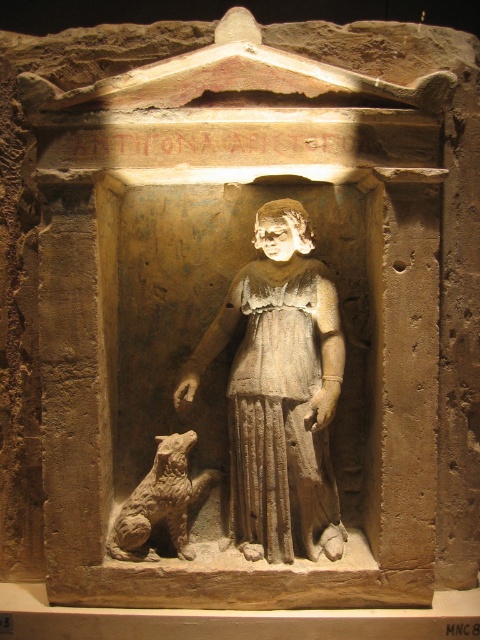
Question: Is gray stone statue at center positioned behind brown textured dog at lower left?

Choices:
 (A) no
 (B) yes

Answer: (A)

Question: Can you confirm if gray stone statue at center is positioned above brown textured dog at lower left?

Choices:
 (A) no
 (B) yes

Answer: (B)

Question: Which point is closer to the camera?

Choices:
 (A) (180, 544)
 (B) (297, 492)

Answer: (B)

Question: Can you confirm if gray stone statue at center is positioned to the right of brown textured dog at lower left?

Choices:
 (A) yes
 (B) no

Answer: (A)